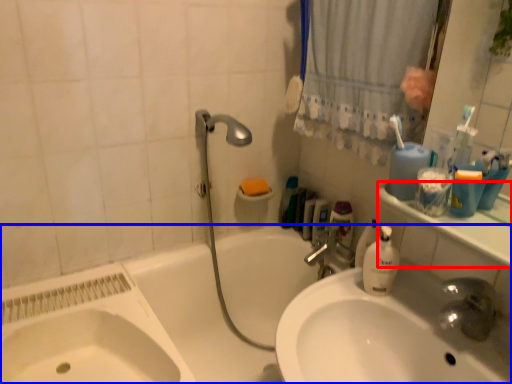
Question: Which object is further to the camera taking this photo, counter top (highlighted by a red box) or bathtub (highlighted by a blue box)?

Choices:
 (A) counter top
 (B) bathtub

Answer: (B)